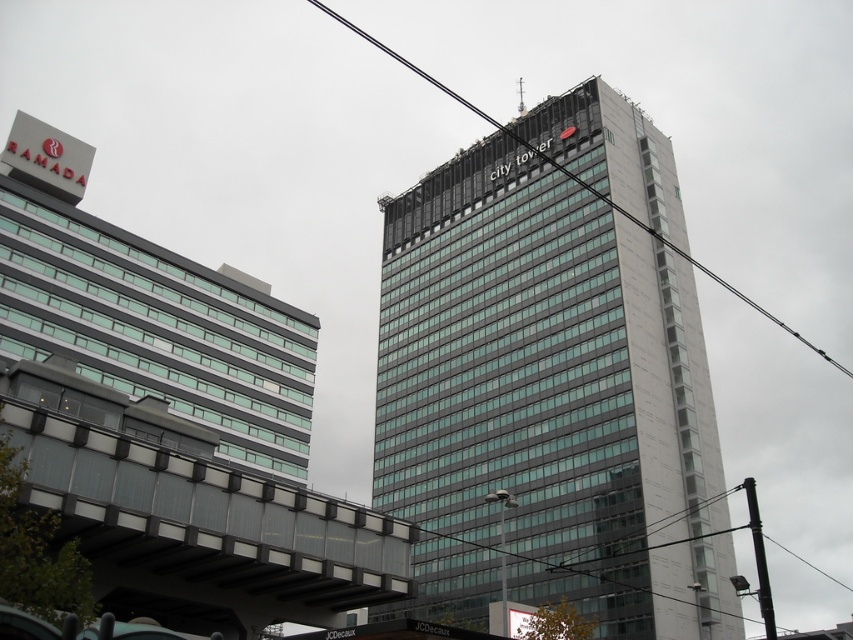
Question: Can you confirm if glassy gray skyscraper at center is positioned below black metallic pole at lower right?

Choices:
 (A) yes
 (B) no

Answer: (B)

Question: Which is farther from the glassy gray skyscraper at center?

Choices:
 (A) black metallic pole at lower right
 (B) black wire at upper center

Answer: (A)

Question: Does black wire at upper center lie behind black metallic pole at lower right?

Choices:
 (A) no
 (B) yes

Answer: (A)

Question: Which of these objects is positioned farthest from the glassy gray skyscraper at center?

Choices:
 (A) black wire at upper center
 (B) black metallic pole at lower right

Answer: (B)

Question: Which is nearer to the black wire at upper center?

Choices:
 (A) black metallic pole at lower right
 (B) glassy gray skyscraper at center

Answer: (B)

Question: Does black wire at upper center appear on the left side of black metallic pole at lower right?

Choices:
 (A) no
 (B) yes

Answer: (B)